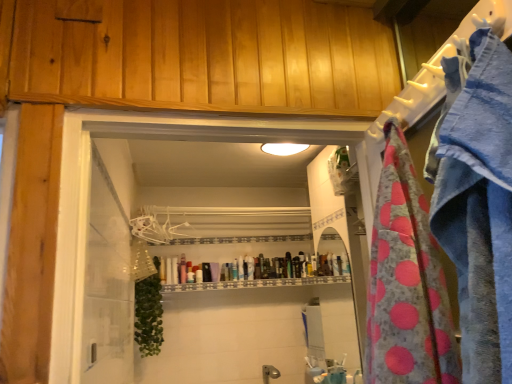
Question: Is white plastic hanger at upper center in front of translucent plastic tube at center?

Choices:
 (A) yes
 (B) no

Answer: (A)

Question: Is white plastic hanger at upper center facing away from translucent plastic tube at center?

Choices:
 (A) yes
 (B) no

Answer: (B)

Question: Does white plastic hanger at upper center have a smaller size compared to translucent plastic tube at center?

Choices:
 (A) no
 (B) yes

Answer: (A)

Question: From the image's perspective, is white plastic hanger at upper center below translucent plastic tube at center?

Choices:
 (A) no
 (B) yes

Answer: (A)

Question: Does white plastic hanger at upper center have a larger size compared to translucent plastic tube at center?

Choices:
 (A) no
 (B) yes

Answer: (B)

Question: Visually, is translucent plastic tube at center positioned to the left or to the right of white plastic hanger at upper center?

Choices:
 (A) left
 (B) right

Answer: (B)

Question: From the image's perspective, is translucent plastic tube at center located above or below white plastic hanger at upper center?

Choices:
 (A) above
 (B) below

Answer: (B)

Question: Considering the positions of translucent plastic tube at center and white plastic hanger at upper center in the image, is translucent plastic tube at center bigger or smaller than white plastic hanger at upper center?

Choices:
 (A) big
 (B) small

Answer: (B)

Question: Relative to white plastic hanger at upper center, is translucent plastic tube at center in front or behind?

Choices:
 (A) front
 (B) behind

Answer: (B)

Question: Relative to pink polka dot fabric at right, is white plastic hanger at upper center in front or behind?

Choices:
 (A) behind
 (B) front

Answer: (A)

Question: Is point (196, 236) closer or farther from the camera than point (431, 238)?

Choices:
 (A) farther
 (B) closer

Answer: (A)

Question: From a real-world perspective, is white plastic hanger at upper center above or below pink polka dot fabric at right?

Choices:
 (A) above
 (B) below

Answer: (A)

Question: Is white plastic hanger at upper center bigger or smaller than pink polka dot fabric at right?

Choices:
 (A) big
 (B) small

Answer: (B)

Question: Looking at the image, does pink polka dot fabric at right seem bigger or smaller compared to translucent plastic tube at center?

Choices:
 (A) big
 (B) small

Answer: (A)

Question: Is pink polka dot fabric at right situated inside translucent plastic tube at center or outside?

Choices:
 (A) inside
 (B) outside

Answer: (B)